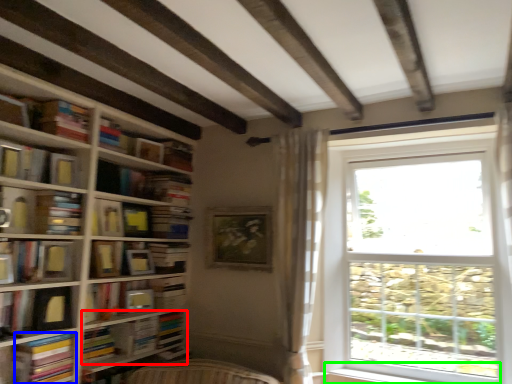
Question: Which object is the farthest from book (highlighted by a red box)? Choose among these: paperback book (highlighted by a blue box) or window sill (highlighted by a green box).

Choices:
 (A) paperback book
 (B) window sill

Answer: (B)